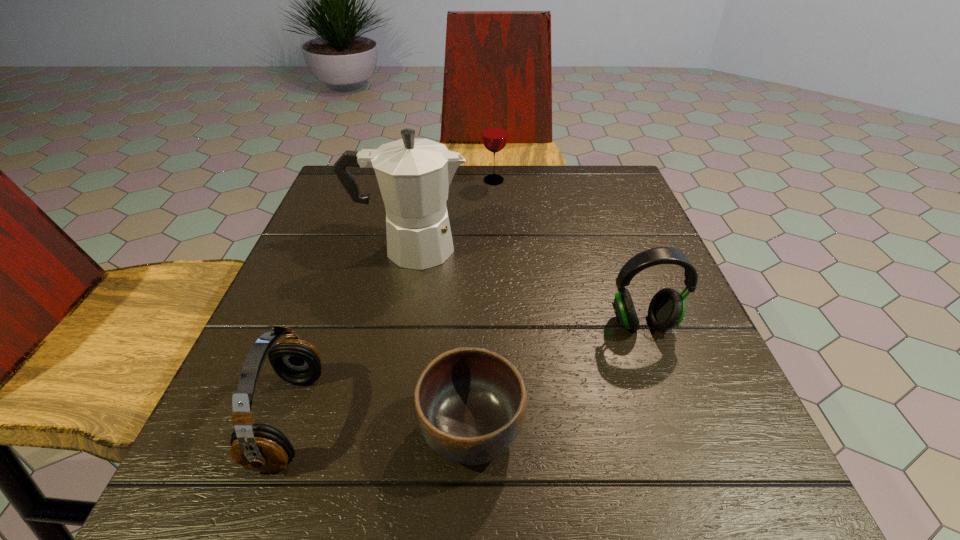
Where is `blank area in the image that satisfies the following two spatial constraints: 1. at the spout of the fourth nearest object; 2. on the left side of the bowl`? The height and width of the screenshot is (540, 960). blank area in the image that satisfies the following two spatial constraints: 1. at the spout of the fourth nearest object; 2. on the left side of the bowl is located at coordinates (375, 430).

You are a GUI agent. You are given a task and a screenshot of the screen. Output one action in this format:
    pyautogui.click(x=<x>, y=<y>)
    Task: Click on the vacant point that satisfies the following two spatial constraints: 1. at the spout of the bowl; 2. on the right side of the tallest object
    The image size is (960, 540).
    Given the screenshot: What is the action you would take?
    pyautogui.click(x=375, y=430)

Locate an element on the screen. vacant point that satisfies the following two spatial constraints: 1. on the ear cups of the third nearest object; 2. on the ear cups of the left headset is located at coordinates (677, 419).

Locate an element on the screen. The height and width of the screenshot is (540, 960). vacant space that satisfies the following two spatial constraints: 1. on the ear cups of the nearer headset; 2. on the back side of the bowl is located at coordinates (286, 430).